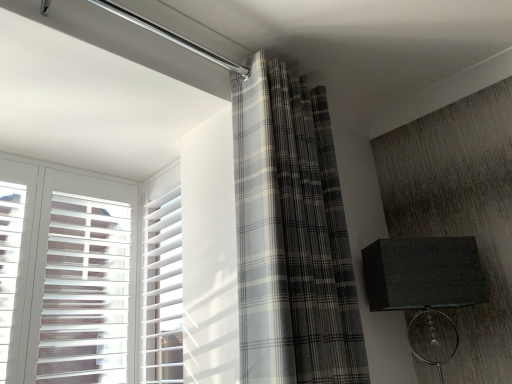
Question: From their relative heights in the image, would you say gray plaid curtain at center is taller or shorter than matte black lampshade at right?

Choices:
 (A) short
 (B) tall

Answer: (B)

Question: Is gray plaid curtain at center wider or thinner than matte black lampshade at right?

Choices:
 (A) thin
 (B) wide

Answer: (A)

Question: Which is farther from the white plastic blinds at left?

Choices:
 (A) matte black lampshade at right
 (B) gray plaid curtain at center

Answer: (A)

Question: Estimate the real-world distances between objects in this image. Which object is farther from the gray plaid curtain at center?

Choices:
 (A) matte black lampshade at right
 (B) white plastic blinds at left

Answer: (B)